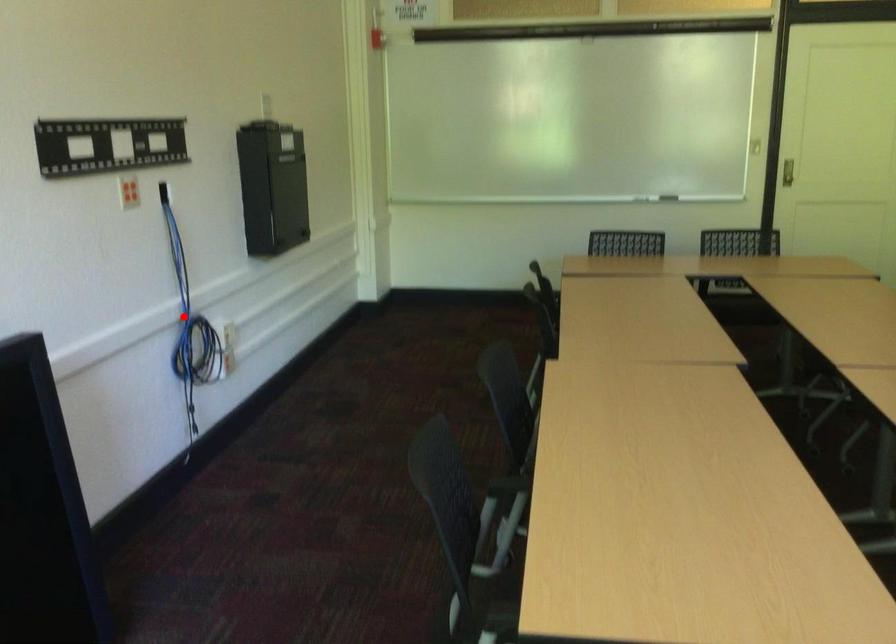
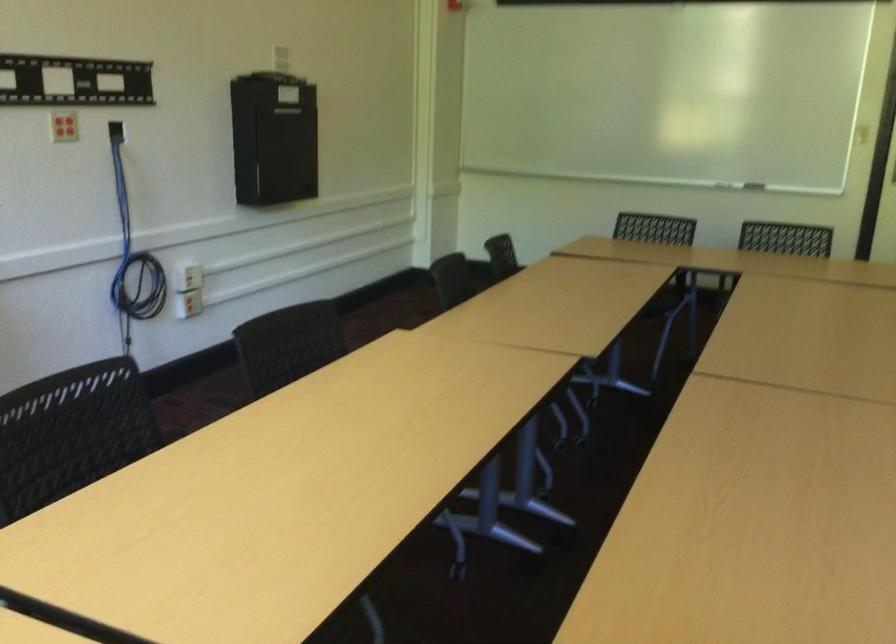
Question: I am providing you with two images of the same scene from different viewpoints. A red point is marked on the first image. Can you still see the location of the red point in image 2?

Choices:
 (A) Yes
 (B) No

Answer: (A)